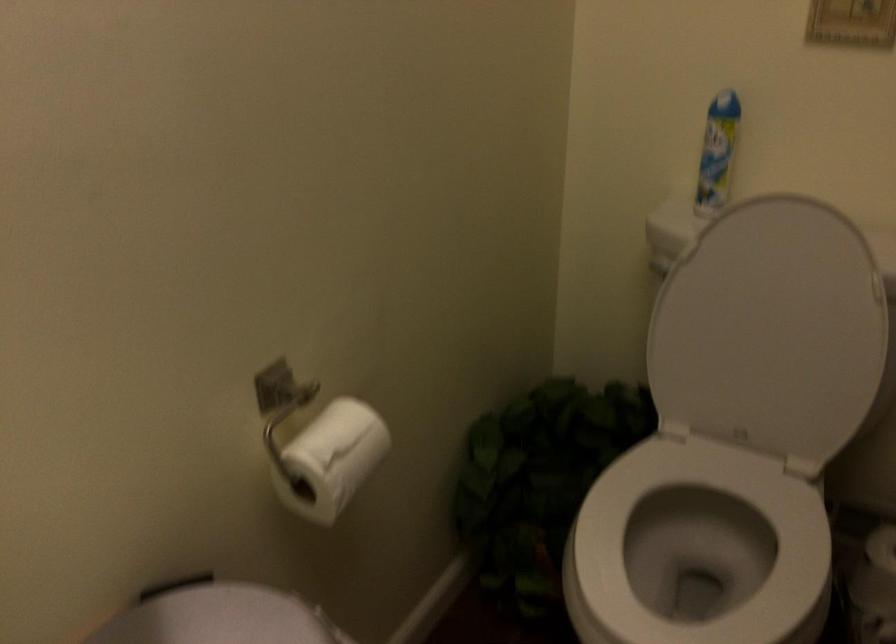
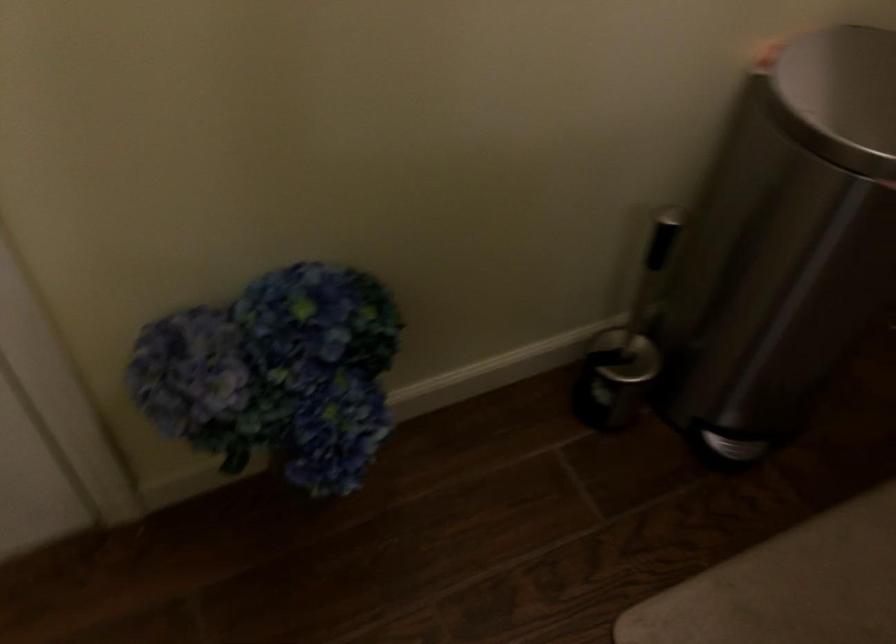
Consider the image. How did the camera likely rotate?

The camera's rotation is toward left-down.